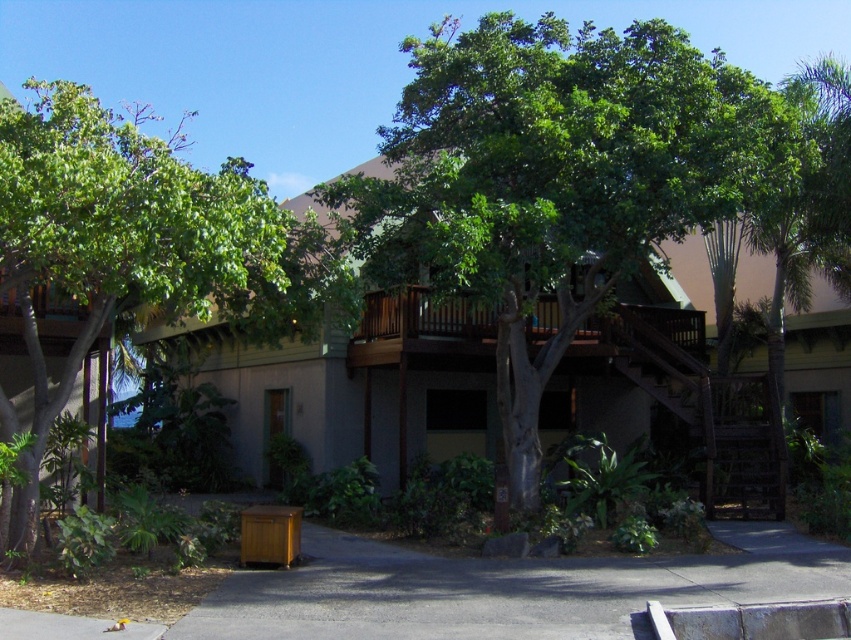
From the picture: Does green leafy tree at left have a greater width compared to dark brown wooden stairs at center-right?

Yes, green leafy tree at left is wider than dark brown wooden stairs at center-right.

Is point (112, 232) positioned after point (621, 326)?

No, (112, 232) is in front of (621, 326).

Where is `green leafy tree at left`? green leafy tree at left is located at coordinates (113, 236).

Between point (532, 22) and point (687, 310), which one is positioned behind?

The point (532, 22) is behind.

Who is higher up, green leafy tree at center or dark brown wooden stairs at center-right?

green leafy tree at center is higher up.

Is point (570, 72) behind point (730, 396)?

No, it is not.

At what (x,y) coordinates should I click in order to perform the action: click on green leafy tree at center. Please return your answer as a coordinate pair (x, y). Looking at the image, I should click on (557, 177).

Who is positioned more to the left, green leafy tree at center or green leafy tree at left?

green leafy tree at left is more to the left.

Which is behind, point (398, 212) or point (231, 289)?

The point (398, 212) is more distant.

This screenshot has height=640, width=851. In order to click on green leafy tree at center in this screenshot , I will do pyautogui.click(x=557, y=177).